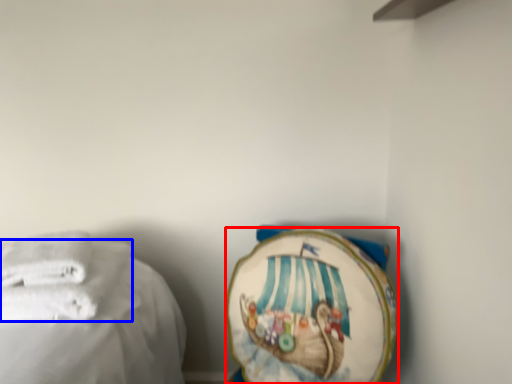
Question: Which object is further to the camera taking this photo, towel (highlighted by a red box) or towel (highlighted by a blue box)?

Choices:
 (A) towel
 (B) towel

Answer: (A)